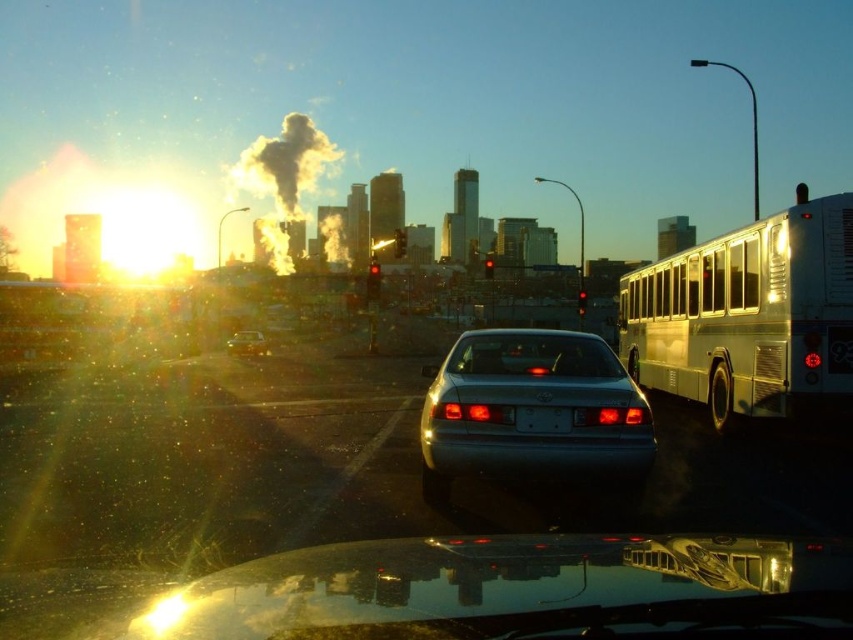
Question: Is satin silver sedan at center above transparent glass windshield at center?

Choices:
 (A) no
 (B) yes

Answer: (A)

Question: Can you confirm if silver metallic bus at right is positioned to the right of transparent glass windshield at center?

Choices:
 (A) no
 (B) yes

Answer: (B)

Question: Which of the following is the closest to the observer?

Choices:
 (A) (250, 336)
 (B) (518, 428)
 (C) (498, 336)

Answer: (B)

Question: Which object appears farthest from the camera in this image?

Choices:
 (A) metallic silver sedan at center
 (B) satin silver sedan at center
 (C) white plastic license plate at center
 (D) transparent glass windshield at center

Answer: (A)

Question: Does transparent glass windshield at center come behind white plastic license plate at center?

Choices:
 (A) no
 (B) yes

Answer: (B)

Question: Which object is farther from the camera taking this photo?

Choices:
 (A) white plastic license plate at center
 (B) silver metallic bus at right
 (C) transparent glass windshield at center

Answer: (B)